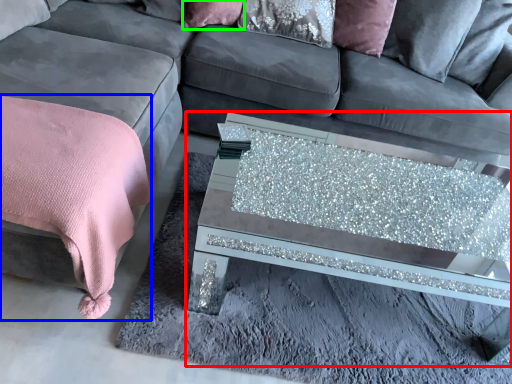
Question: Considering the real-world distances, which object is closest to coffee table (highlighted by a red box)? blanket (highlighted by a blue box) or pillow (highlighted by a green box).

Choices:
 (A) blanket
 (B) pillow

Answer: (A)